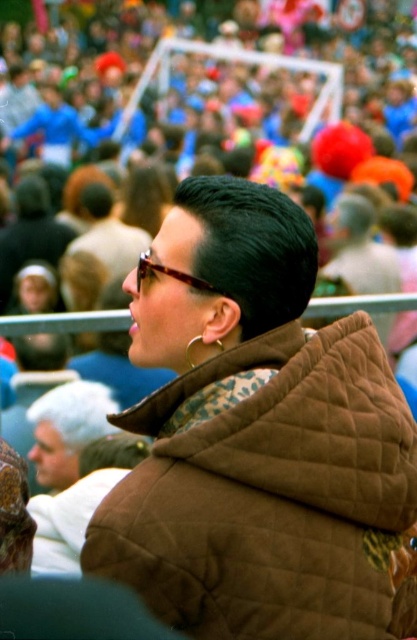
Looking at this image, is brown quilted jacket at center in front of tortoiseshell glasses at center?

Yes, brown quilted jacket at center is closer to the viewer.

Is point (246, 474) less distant than point (138, 280)?

Yes, it is.

The height and width of the screenshot is (640, 417). What are the coordinates of `brown quilted jacket at center` in the screenshot? It's located at (256, 436).

Find the location of `brown quilted jacket at center`. brown quilted jacket at center is located at coordinates pyautogui.click(x=256, y=436).

Between brown quilted jacket at center and light brown leather jacket at lower left, which one has more height?

brown quilted jacket at center is taller.

Is brown quilted jacket at center thinner than light brown leather jacket at lower left?

In fact, brown quilted jacket at center might be wider than light brown leather jacket at lower left.

Looking at this image, who is more distant from viewer, (218,224) or (57,406)?

The point (57,406) is behind.

The height and width of the screenshot is (640, 417). Find the location of `brown quilted jacket at center`. brown quilted jacket at center is located at coordinates (256, 436).

Between light brown leather jacket at lower left and tortoiseshell glasses at center, which one is positioned lower?

light brown leather jacket at lower left is lower down.

Between light brown leather jacket at lower left and tortoiseshell glasses at center, which one appears on the left side from the viewer's perspective?

Positioned to the left is light brown leather jacket at lower left.

Does point (80, 451) come behind point (150, 269)?

That is True.

Where is `light brown leather jacket at lower left`? The image size is (417, 640). light brown leather jacket at lower left is located at coordinates (67, 428).